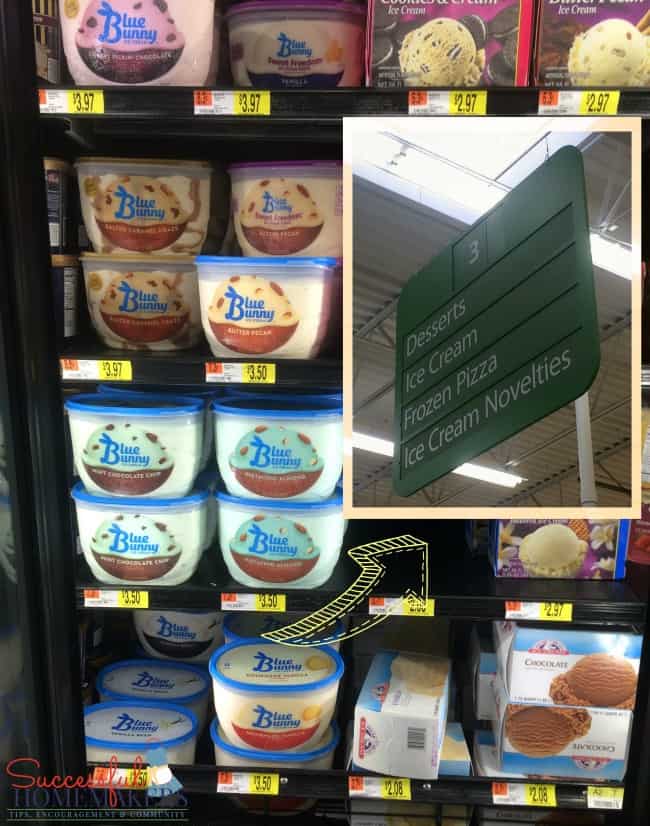
At what (x,y) coordinates should I click in order to perform the action: click on ceiling. Please return your answer as a coordinate pair (x, y). The height and width of the screenshot is (826, 650). Looking at the image, I should click on (408, 225).